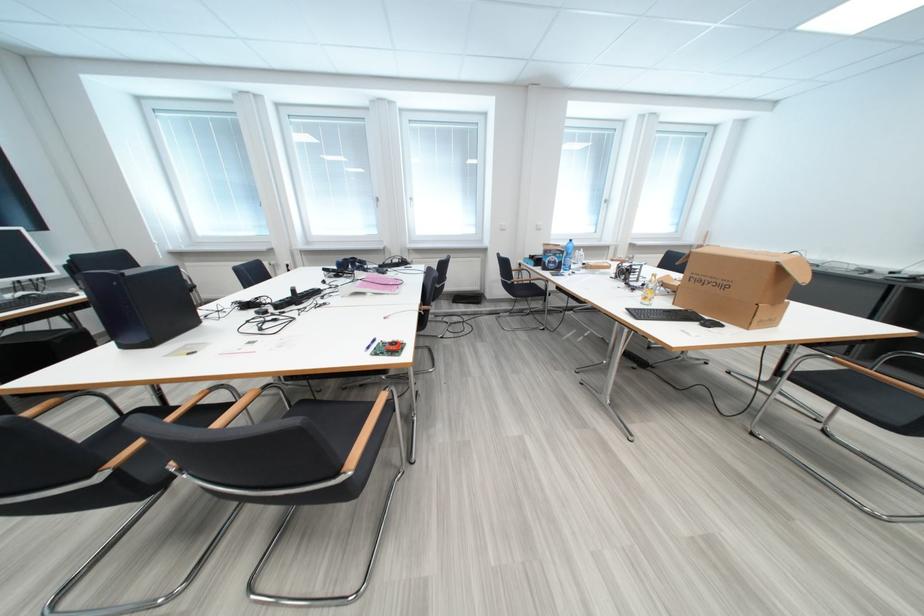
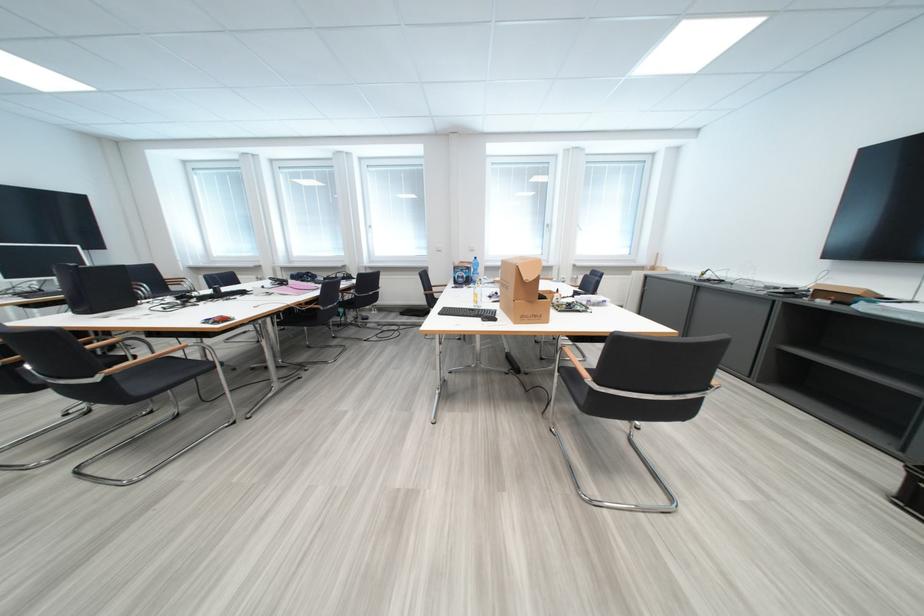
Question: The images are taken continuously from a first-person perspective. In which direction are you moving?

Choices:
 (A) Left
 (B) Right
 (C) Forward
 (D) Backward

Answer: (B)